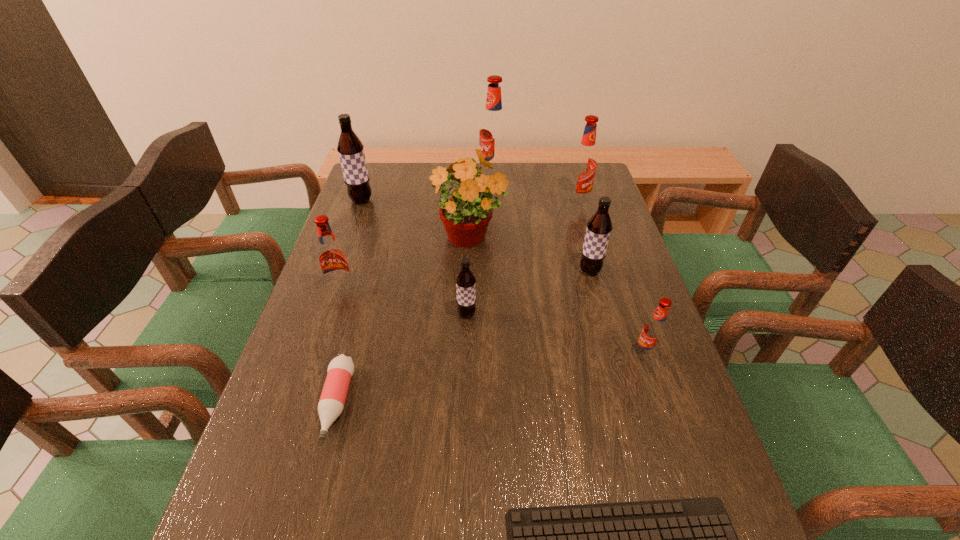
You are a GUI agent. You are given a task and a screenshot of the screen. Output one action in this format:
    pyautogui.click(x=<x>, y=<y>)
    Task: Click on the red root beer that is the nearest to the rightmost brown root beer
    
    Given the screenshot: What is the action you would take?
    pyautogui.click(x=654, y=330)

Where is `red root beer that is the fourth closest to the leftmost brown root beer`? This screenshot has width=960, height=540. red root beer that is the fourth closest to the leftmost brown root beer is located at coordinates tap(654, 330).

Identify the location of brown root beer that is the second closest to the fourth root beer from right to left. This screenshot has height=540, width=960. (599, 227).

Image resolution: width=960 pixels, height=540 pixels. I want to click on brown root beer identified as the third closest to the third nearest red root beer, so click(351, 153).